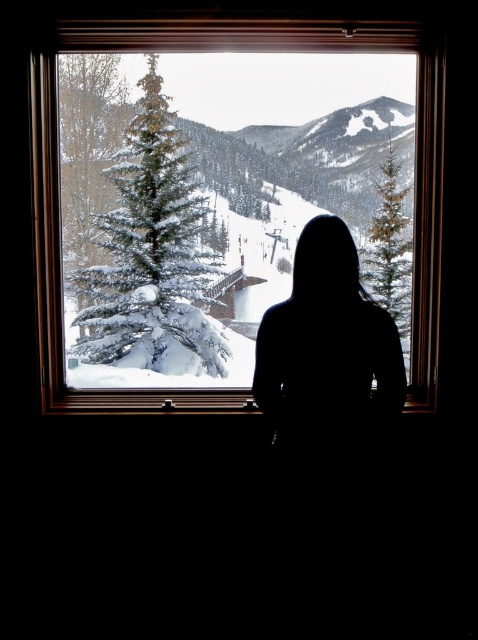
You are an architect designing a new window display. You need to ensure that the silhouette figure at center and the green textured pine at right are visible from the street. Given that the window display is 1.5 meters wide, can both objects fit side by side without overlapping?

The silhouette figure at center is wider than the green textured pine at right. Since the total width of both objects combined would exceed the 1.5 meter window display, they cannot fit side by side without overlapping.